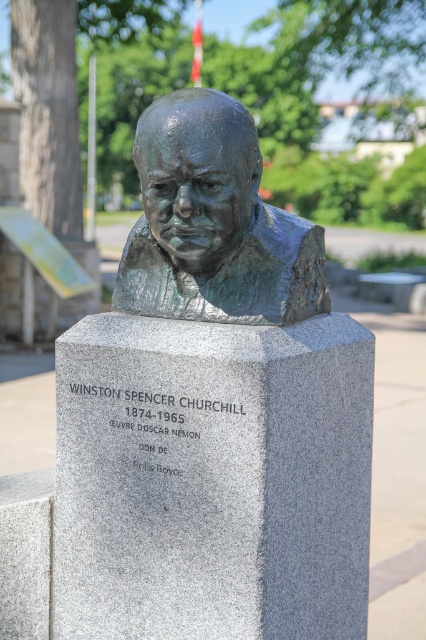
Question: Is bronze bust at center below bronze sculpture at center?

Choices:
 (A) no
 (B) yes

Answer: (B)

Question: Is bronze bust at center below bronze sculpture at center?

Choices:
 (A) yes
 (B) no

Answer: (A)

Question: Which point is closer to the camera taking this photo?

Choices:
 (A) (91, 592)
 (B) (301, 272)

Answer: (B)

Question: Which of the following is the farthest from the observer?

Choices:
 (A) bronze bust at center
 (B) bronze sculpture at center

Answer: (B)

Question: Which point appears closest to the camera in this image?

Choices:
 (A) (138, 579)
 (B) (149, 108)

Answer: (B)

Question: Is bronze bust at center further to camera compared to bronze sculpture at center?

Choices:
 (A) no
 (B) yes

Answer: (A)